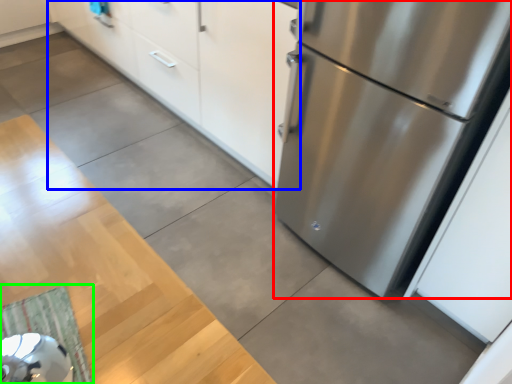
Question: Based on their relative distances, which object is farther from refrigerator (highlighted by a red box)? Choose from cabinetry (highlighted by a blue box) and doormat (highlighted by a green box).

Choices:
 (A) cabinetry
 (B) doormat

Answer: (B)